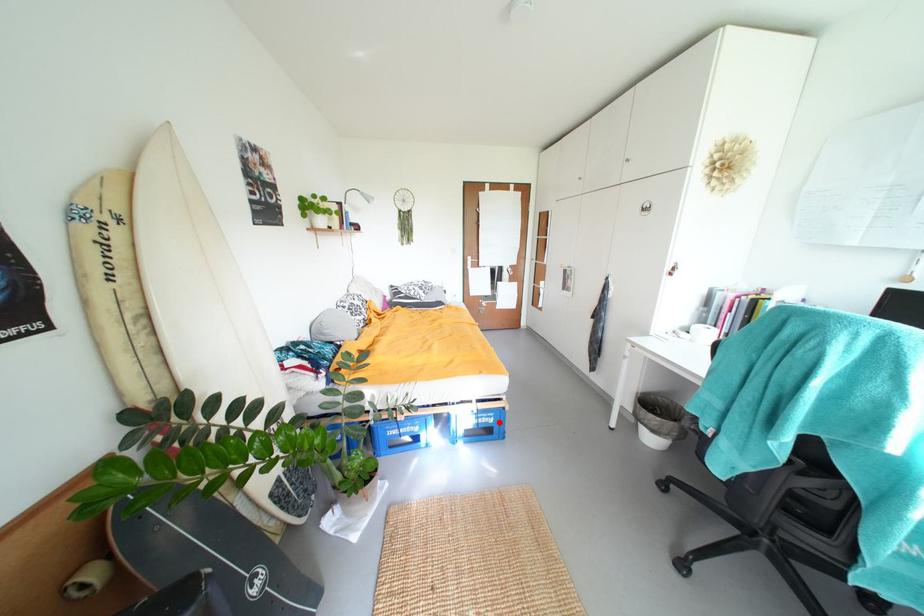
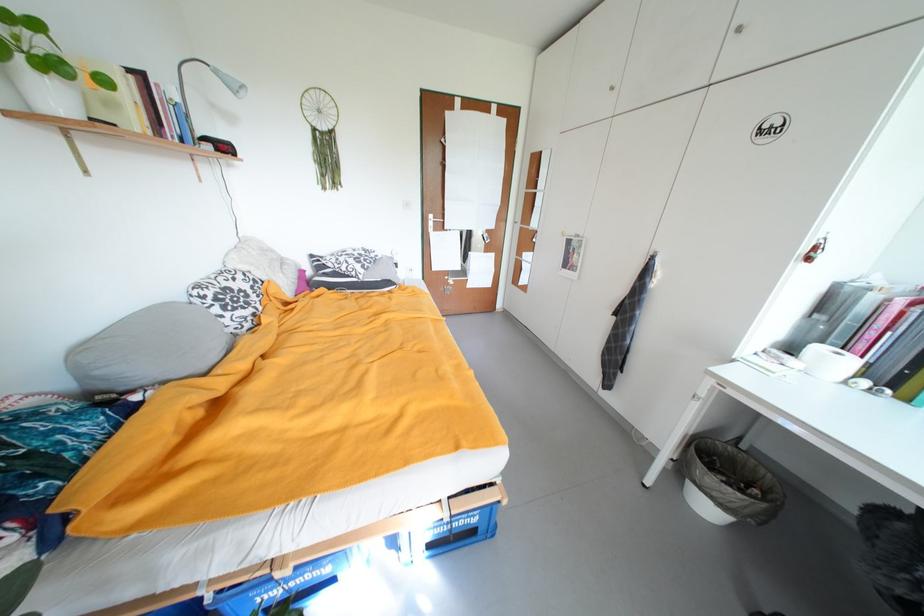
Question: A red point is marked in image1. In image2, is the corresponding 3D point closer to the camera or farther? Reply with the corresponding letter.

Choices:
 (A) The corresponding 3D point is closer.
 (B) The corresponding 3D point is farther.

Answer: (A)